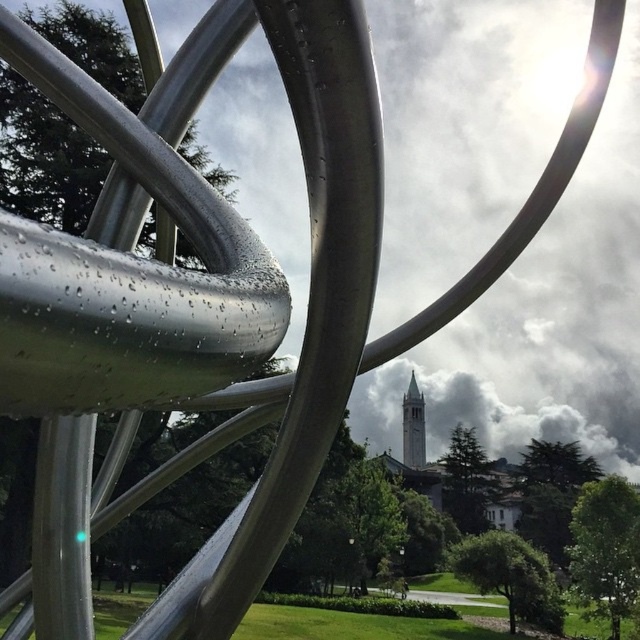
You are standing in the park and want to take a photo of both the metallic silver sculpture at center and the gray stone bell tower at center. Which object should you zoom in on to ensure both fit in the frame?

Since the metallic silver sculpture at center is smaller than the gray stone bell tower at center, you should zoom in on the gray stone bell tower at center to ensure both fit in the frame.

You are an architect evaluating the spatial relationship between the metallic silver sculpture at center and the gray stone bell tower at center. Which object is narrower?

The metallic silver sculpture at center has a lesser width compared to the gray stone bell tower at center, so the metallic silver sculpture at center is narrower.